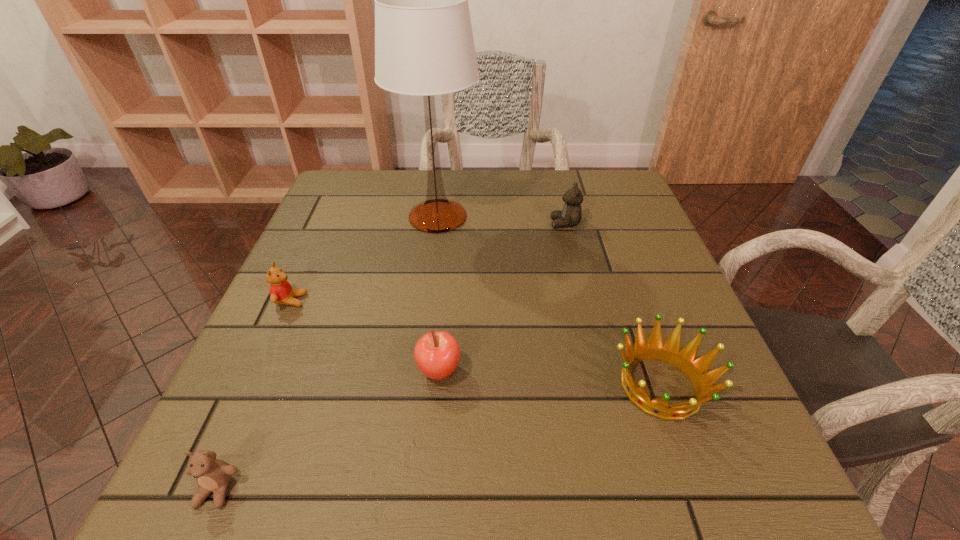
The width and height of the screenshot is (960, 540). In the image, there is a desktop. What are the coordinates of `vacant space at the left edge` in the screenshot? It's located at (350, 217).

In the image, there is a desktop. In order to click on vacant space at the right edge in this screenshot , I will do `click(652, 442)`.

Where is `vacant region at the far left corner of the desktop`? The height and width of the screenshot is (540, 960). vacant region at the far left corner of the desktop is located at coordinates (339, 184).

Identify the location of empty space between the nearest teddy bear and the rightmost teddy bear. [x=391, y=357].

This screenshot has height=540, width=960. Find the location of `free area in between the farthest teddy bear and the crown`. free area in between the farthest teddy bear and the crown is located at coordinates (612, 305).

Locate an element on the screen. The image size is (960, 540). empty location between the farthest teddy bear and the crown is located at coordinates (612, 305).

I want to click on vacant space that is in between the tallest object and the second farthest teddy bear, so click(364, 259).

Find the location of `blank region between the nearest object and the crown`. blank region between the nearest object and the crown is located at coordinates (439, 438).

Locate an element on the screen. Image resolution: width=960 pixels, height=540 pixels. empty location between the farthest teddy bear and the fourth nearest object is located at coordinates (428, 262).

Where is `empty space between the apple and the crown`? empty space between the apple and the crown is located at coordinates (550, 379).